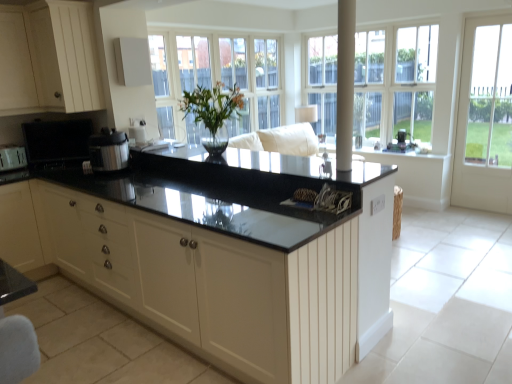
Identify the location of satin silver pressure cooker at center, acting as the fourth appliance starting from the back. The height and width of the screenshot is (384, 512). (108, 150).

What is the approximate width of satin silver pressure cooker at center, the first appliance positioned from the front?

satin silver pressure cooker at center, the first appliance positioned from the front, is 11.83 inches in width.

The width and height of the screenshot is (512, 384). What do you see at coordinates (394, 85) in the screenshot?
I see `clear glass windows at upper center` at bounding box center [394, 85].

Measure the distance between clear glass windows at upper center and camera.

14.55 feet.

This screenshot has height=384, width=512. Identify the location of white glossy pole at center. (345, 84).

The width and height of the screenshot is (512, 384). What do you see at coordinates (485, 117) in the screenshot?
I see `white glass door at right` at bounding box center [485, 117].

Image resolution: width=512 pixels, height=384 pixels. I want to click on satin black speaker at upper right, positioned as the fourth appliance in front-to-back order, so click(x=401, y=143).

The width and height of the screenshot is (512, 384). Describe the element at coordinates (12, 157) in the screenshot. I see `metallic silver toaster at left, the 2th appliance from the front` at that location.

Locate an element on the screen. Image resolution: width=512 pixels, height=384 pixels. satin silver pressure cooker at center, the first appliance positioned from the front is located at coordinates (108, 150).

From the image's perspective, is satin silver pressure cooker at center, marked as the 3th appliance in a left-to-right arrangement, located above or below white glass door at right?

From the image's perspective, satin silver pressure cooker at center, marked as the 3th appliance in a left-to-right arrangement, appears below white glass door at right.

Looking at this image, considering the sizes of objects satin silver pressure cooker at center, marked as the 3th appliance in a left-to-right arrangement, and white glass door at right in the image provided, who is taller, satin silver pressure cooker at center, marked as the 3th appliance in a left-to-right arrangement, or white glass door at right?

With more height is white glass door at right.

Can you confirm if satin silver pressure cooker at center, the first appliance positioned from the front, is bigger than white glass door at right?

Actually, satin silver pressure cooker at center, the first appliance positioned from the front, might be smaller than white glass door at right.

Based on their positions, is satin silver pressure cooker at center, marked as the 3th appliance in a left-to-right arrangement, located to the left or right of white glass door at right?

From the image, it's evident that satin silver pressure cooker at center, marked as the 3th appliance in a left-to-right arrangement, is to the left of white glass door at right.

Can you confirm if black polished granite countertop at center, the 2th countertop when ordered from top to bottom, is thinner than clear glass windows at upper center?

No, black polished granite countertop at center, the 2th countertop when ordered from top to bottom, is not thinner than clear glass windows at upper center.

From a real-world perspective, is black polished granite countertop at center, the 2th countertop when ordered from top to bottom, located higher than clear glass windows at upper center?

No.

Is the surface of black polished granite countertop at center, the 2th countertop when ordered from top to bottom, in direct contact with clear glass windows at upper center?

No, black polished granite countertop at center, the 2th countertop when ordered from top to bottom, is not next to clear glass windows at upper center.

Which of these two, black polished granite countertop at center, the 2th countertop when ordered from top to bottom, or clear glass windows at upper center, stands taller?

clear glass windows at upper center.

From the image's perspective, is black granite countertop at center, the 1th countertop in the top-to-bottom sequence, positioned above or below satin silver pressure cooker at center, marked as the 3th appliance in a left-to-right arrangement?

From the image's perspective, black granite countertop at center, the 1th countertop in the top-to-bottom sequence, appears below satin silver pressure cooker at center, marked as the 3th appliance in a left-to-right arrangement.

Would you say black granite countertop at center, the 1th countertop in the top-to-bottom sequence, contains satin silver pressure cooker at center, marked as the 3th appliance in a left-to-right arrangement?

No, satin silver pressure cooker at center, marked as the 3th appliance in a left-to-right arrangement, is located outside of black granite countertop at center, the 1th countertop in the top-to-bottom sequence.

How much distance is there between black granite countertop at center, arranged as the 2th countertop when ordered from the bottom, and satin silver pressure cooker at center, the first appliance positioned from the front?

black granite countertop at center, arranged as the 2th countertop when ordered from the bottom, is 21.91 inches away from satin silver pressure cooker at center, the first appliance positioned from the front.

Which of these two, black granite countertop at center, arranged as the 2th countertop when ordered from the bottom, or satin silver pressure cooker at center, the first appliance positioned from the front, stands shorter?

black granite countertop at center, arranged as the 2th countertop when ordered from the bottom.

Is satin black speaker at upper right, acting as the 1th appliance starting from the right, turned away from metallic silver toaster at left, which ranks as the 3th appliance in back-to-front order?

No, satin black speaker at upper right, acting as the 1th appliance starting from the right, is not facing away from metallic silver toaster at left, which ranks as the 3th appliance in back-to-front order.

Is point (397, 139) positioned after point (10, 161)?

Yes.

Is satin black speaker at upper right, positioned as the fourth appliance in front-to-back order, positioned behind metallic silver toaster at left, which ranks as the 3th appliance in back-to-front order?

Yes, satin black speaker at upper right, positioned as the fourth appliance in front-to-back order, is further from the viewer.

Can you confirm if satin black speaker at upper right, positioned as the fourth appliance in front-to-back order, is positioned to the left of metallic silver toaster at left, the 2th appliance from the front?

No, satin black speaker at upper right, positioned as the fourth appliance in front-to-back order, is not to the left of metallic silver toaster at left, the 2th appliance from the front.

What's the angular difference between satin silver pressure cooker at center, the 2th appliance from the right, and satin black speaker at upper right, which ranks as the fourth appliance in left-to-right order,'s facing directions?

The facing directions of satin silver pressure cooker at center, the 2th appliance from the right, and satin black speaker at upper right, which ranks as the fourth appliance in left-to-right order, are 1.08 degrees apart.

Which of these two, satin silver pressure cooker at center, the first appliance positioned from the front, or satin black speaker at upper right, acting as the 1th appliance starting from the right, is wider?

satin silver pressure cooker at center, the first appliance positioned from the front.

Is satin silver pressure cooker at center, the first appliance positioned from the front, further to camera compared to satin black speaker at upper right, positioned as the fourth appliance in front-to-back order?

No, satin silver pressure cooker at center, the first appliance positioned from the front, is closer to the viewer.

Image resolution: width=512 pixels, height=384 pixels. In order to click on appliance that is the 3rd object located behind the satin silver pressure cooker at center, acting as the fourth appliance starting from the back in this screenshot , I will do `click(401, 143)`.

Is white glossy pole at center a part of black granite countertop at center, the 1th countertop in the top-to-bottom sequence?

No, white glossy pole at center is located outside of black granite countertop at center, the 1th countertop in the top-to-bottom sequence.

Does black granite countertop at center, the 1th countertop in the top-to-bottom sequence, have a lesser width compared to white glossy pole at center?

No, black granite countertop at center, the 1th countertop in the top-to-bottom sequence, is not thinner than white glossy pole at center.

Considering the sizes of objects black granite countertop at center, arranged as the 2th countertop when ordered from the bottom, and white glossy pole at center in the image provided, who is shorter, black granite countertop at center, arranged as the 2th countertop when ordered from the bottom, or white glossy pole at center?

Standing shorter between the two is black granite countertop at center, arranged as the 2th countertop when ordered from the bottom.

Between satin black speaker at upper right, acting as the 1th appliance starting from the right, and black polished granite countertop at center, which is counted as the 1th countertop, starting from the bottom, which one is positioned in front?

black polished granite countertop at center, which is counted as the 1th countertop, starting from the bottom.

Which object is positioned more to the right, satin black speaker at upper right, positioned as the first appliance in back-to-front order, or black polished granite countertop at center, which is counted as the 1th countertop, starting from the bottom?

From the viewer's perspective, satin black speaker at upper right, positioned as the first appliance in back-to-front order, appears more on the right side.

Does satin black speaker at upper right, positioned as the fourth appliance in front-to-back order, have a greater width compared to black polished granite countertop at center, which is counted as the 1th countertop, starting from the bottom?

Incorrect, the width of satin black speaker at upper right, positioned as the fourth appliance in front-to-back order, does not surpass that of black polished granite countertop at center, which is counted as the 1th countertop, starting from the bottom.

Is point (401, 147) closer or farther from the camera than point (282, 251)?

Clearly, point (401, 147) is more distant from the camera than point (282, 251).

Find the location of a particular element. This screenshot has height=384, width=512. door that appears on the right of satin silver pressure cooker at center, the 2th appliance from the right is located at coordinates (485, 117).

Where is `window located above the black polished granite countertop at center, which is counted as the 1th countertop, starting from the bottom (from the image's perspective)`? Image resolution: width=512 pixels, height=384 pixels. window located above the black polished granite countertop at center, which is counted as the 1th countertop, starting from the bottom (from the image's perspective) is located at coordinates (394, 85).

Based on their spatial positions, is black polished granite countertop at center, which is counted as the 1th countertop, starting from the bottom, or metallic silver toaster at left, marked as the fourth appliance in a right-to-left arrangement, further from matte black television at left, the third appliance when ordered from front to back?

The object further to matte black television at left, the third appliance when ordered from front to back, is black polished granite countertop at center, which is counted as the 1th countertop, starting from the bottom.

Considering their positions, is satin black speaker at upper right, positioned as the first appliance in back-to-front order, positioned further to matte black television at left, which is the 2th appliance in left-to-right order, than black granite countertop at center, the 1th countertop in the top-to-bottom sequence?

satin black speaker at upper right, positioned as the first appliance in back-to-front order, lies further to matte black television at left, which is the 2th appliance in left-to-right order, than the other object.

Based on their spatial positions, is black polished granite countertop at center, the 2th countertop when ordered from top to bottom, or satin silver pressure cooker at center, acting as the fourth appliance starting from the back, further from metallic silver toaster at left, which ranks as the 3th appliance in back-to-front order?

The object further to metallic silver toaster at left, which ranks as the 3th appliance in back-to-front order, is black polished granite countertop at center, the 2th countertop when ordered from top to bottom.

From the picture: Estimate the real-world distances between objects in this image. Which object is further from black granite countertop at center, arranged as the 2th countertop when ordered from the bottom, black polished granite countertop at center, which is counted as the 1th countertop, starting from the bottom, or clear glass windows at upper center?

clear glass windows at upper center is further to black granite countertop at center, arranged as the 2th countertop when ordered from the bottom.

Consider the image. Considering their positions, is matte black television at left, the third appliance when ordered from front to back, positioned further to white glass door at right than white glossy pole at center?

The object further to white glass door at right is matte black television at left, the third appliance when ordered from front to back.

Looking at the image, which one is located closer to matte black television at left, which is the 2th appliance in left-to-right order, metallic silver toaster at left, marked as the fourth appliance in a right-to-left arrangement, or white glossy pole at center?

metallic silver toaster at left, marked as the fourth appliance in a right-to-left arrangement, lies closer to matte black television at left, which is the 2th appliance in left-to-right order, than the other object.

Looking at the image, which one is located closer to black granite countertop at center, arranged as the 2th countertop when ordered from the bottom, white glossy pole at center or clear glass windows at upper center?

white glossy pole at center lies closer to black granite countertop at center, arranged as the 2th countertop when ordered from the bottom, than the other object.

Estimate the real-world distances between objects in this image. Which object is further from matte black television at left, placed as the third appliance when sorted from right to left, satin silver pressure cooker at center, the 2th appliance from the right, or clear glass windows at upper center?

clear glass windows at upper center is positioned further to the anchor matte black television at left, placed as the third appliance when sorted from right to left.

The width and height of the screenshot is (512, 384). What are the coordinates of `countertop between black polished granite countertop at center, which is counted as the 1th countertop, starting from the bottom, and clear glass windows at upper center from front to back` in the screenshot? It's located at (253, 164).

In order to click on cabinetry between metallic silver toaster at left, the 2th appliance from the front, and black granite countertop at center, the 1th countertop in the top-to-bottom sequence in this screenshot , I will do click(48, 59).

At what (x,y) coordinates should I click in order to perform the action: click on countertop between black polished granite countertop at center, the 2th countertop when ordered from top to bottom, and white wood cabinet at upper left, along the z-axis. Please return your answer as a coordinate pair (x, y). The image size is (512, 384). Looking at the image, I should click on (253, 164).

Find the location of `cabinetry situated between metallic silver toaster at left, arranged as the 1th appliance when viewed from the left, and clear glass windows at upper center from left to right`. cabinetry situated between metallic silver toaster at left, arranged as the 1th appliance when viewed from the left, and clear glass windows at upper center from left to right is located at coordinates (48, 59).